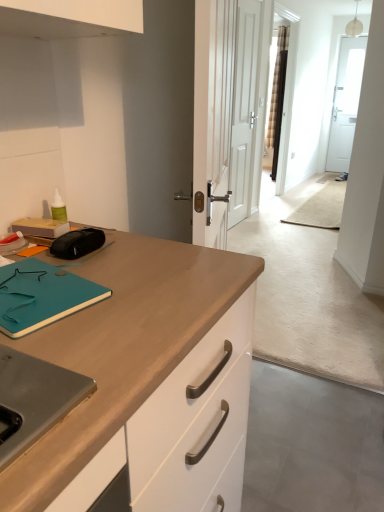
At what (x,y) coordinates should I click in order to perform the action: click on white matte door at center. Please return your answer as a coordinate pair (x, y). The image size is (384, 512). Looking at the image, I should click on tap(244, 108).

Describe the element at coordinates (244, 108) in the screenshot. I see `white matte door at center` at that location.

What is the approximate width of white matte door at center?

white matte door at center is 2.31 inches in width.

I want to click on teal matte notepad at left, so click(x=41, y=296).

What do you see at coordinates (41, 296) in the screenshot? The width and height of the screenshot is (384, 512). I see `teal matte notepad at left` at bounding box center [41, 296].

Where is `white matte door at center`? white matte door at center is located at coordinates (244, 108).

Visually, is white matte door at center positioned to the left or to the right of teal matte notepad at left?

In the image, white matte door at center appears on the right side of teal matte notepad at left.

Looking at this image, considering their positions, is white matte door at center located in front of or behind teal matte notepad at left?

In the image, white matte door at center appears behind teal matte notepad at left.

Is point (239, 102) behind point (20, 283)?

Yes, point (239, 102) is farther from viewer.

From the image's perspective, is white matte door at center located beneath teal matte notepad at left?

No.

From a real-world perspective, is white matte door at center physically located above or below teal matte notepad at left?

In terms of real-world spatial position, white matte door at center is above teal matte notepad at left.

Can you confirm if white matte door at center is thinner than teal matte notepad at left?

Correct, the width of white matte door at center is less than that of teal matte notepad at left.

Can you confirm if white matte door at center is taller than teal matte notepad at left?

Yes, white matte door at center is taller than teal matte notepad at left.

Looking at the image, does white matte door at center seem bigger or smaller compared to teal matte notepad at left?

Considering their sizes, white matte door at center takes up more space than teal matte notepad at left.

Is white matte door at center not inside teal matte notepad at left?

white matte door at center is positioned outside teal matte notepad at left.

Consider the image. Is white matte door at center directly adjacent to teal matte notepad at left?

white matte door at center and teal matte notepad at left are not in contact.

Is white matte door at center positioned with its back to teal matte notepad at left?

white matte door at center is not turned away from teal matte notepad at left.

How far apart are white matte door at center and teal matte notepad at left?

white matte door at center and teal matte notepad at left are 3.46 meters apart from each other.

Find the location of `notepad below the white matte door at center (from the image's perspective)`. notepad below the white matte door at center (from the image's perspective) is located at coordinates (41, 296).

Based on the photo, is teal matte notepad at left to the left of white matte door at center from the viewer's perspective?

Yes, teal matte notepad at left is to the left of white matte door at center.

Which object is further away from the camera taking this photo, teal matte notepad at left or white matte door at center?

white matte door at center is behind.

Does point (30, 327) appear closer or farther from the camera than point (243, 22)?

Clearly, point (30, 327) is closer to the camera than point (243, 22).

From the image's perspective, between teal matte notepad at left and white matte door at center, which one is located above?

white matte door at center is shown above in the image.

From a real-world perspective, is teal matte notepad at left below white matte door at center?

Indeed, from a real-world perspective, teal matte notepad at left is positioned beneath white matte door at center.

Considering the relative sizes of teal matte notepad at left and white matte door at center in the image provided, is teal matte notepad at left thinner than white matte door at center?

No, teal matte notepad at left is not thinner than white matte door at center.

Is teal matte notepad at left taller or shorter than white matte door at center?

teal matte notepad at left is shorter than white matte door at center.

Considering the sizes of objects teal matte notepad at left and white matte door at center in the image provided, who is bigger, teal matte notepad at left or white matte door at center?

white matte door at center is bigger.

Would you say teal matte notepad at left is inside or outside white matte door at center?

teal matte notepad at left lies outside white matte door at center.

Would you consider teal matte notepad at left to be distant from white matte door at center?

Yes, teal matte notepad at left and white matte door at center are quite far apart.

Is teal matte notepad at left facing towards white matte door at center?

No, teal matte notepad at left does not turn towards white matte door at center.

Can you tell me how much teal matte notepad at left and white matte door at center differ in facing direction?

The angular difference between teal matte notepad at left and white matte door at center is 9.86 degrees.

Measure the distance between teal matte notepad at left and white matte door at center.

They are 3.46 meters apart.

I want to click on door above the teal matte notepad at left (from the image's perspective), so click(x=244, y=108).

Where is `notepad below the white matte door at center (from the image's perspective)`? The width and height of the screenshot is (384, 512). notepad below the white matte door at center (from the image's perspective) is located at coordinates (41, 296).

Where is `door located on the right of teal matte notepad at left`? The width and height of the screenshot is (384, 512). door located on the right of teal matte notepad at left is located at coordinates (244, 108).